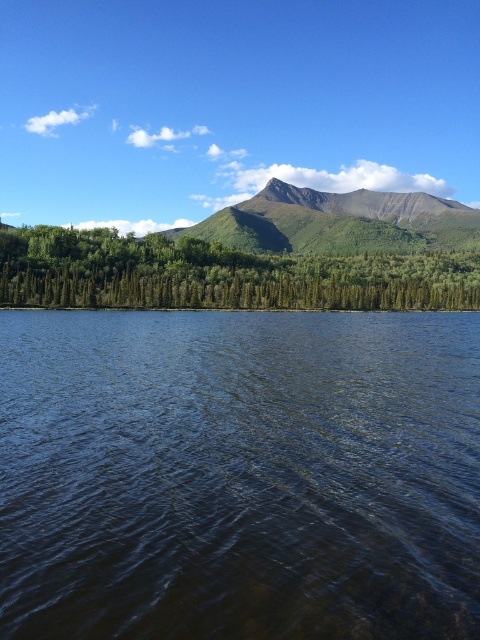
You are planning to paint this landscape and want to ensure the dark blue water at center and the green matte trees at center are proportionally accurate. Based on the scene, which object should you make narrower in your painting?

The dark blue water at center should be made narrower because its width is less than that of the green matte trees at center.